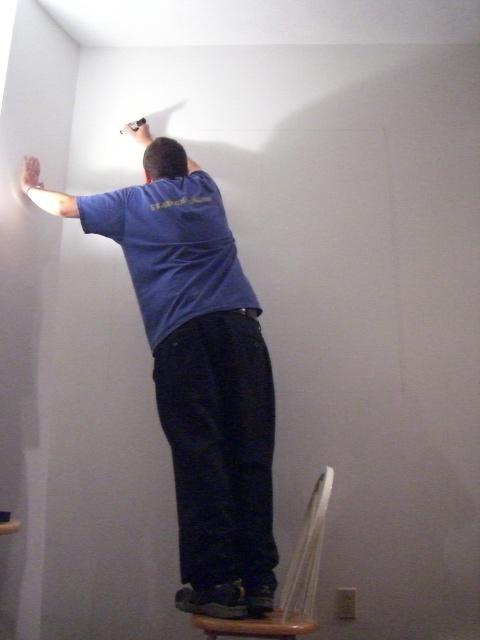
Between blue t-shirt at upper center and wooden stool at lower center, which one is positioned higher?

blue t-shirt at upper center

Describe the element at coordinates (196, 369) in the screenshot. The height and width of the screenshot is (640, 480). I see `blue t-shirt at upper center` at that location.

Looking at this image, measure the distance between point [187,182] and camera.

Point [187,182] and camera are 6.97 feet apart from each other.

Image resolution: width=480 pixels, height=640 pixels. In order to click on blue t-shirt at upper center in this screenshot , I will do `click(196, 369)`.